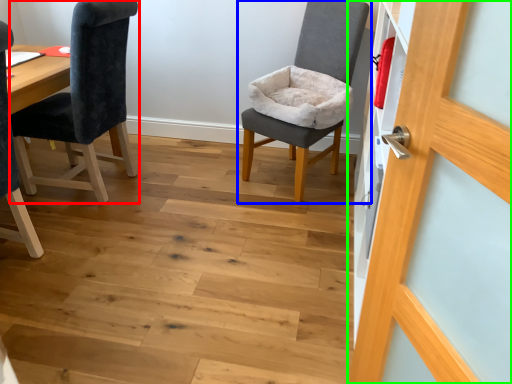
Question: Based on their relative distances, which object is nearer to chair (highlighted by a red box)? Choose from chair (highlighted by a blue box) and door (highlighted by a green box).

Choices:
 (A) chair
 (B) door

Answer: (A)